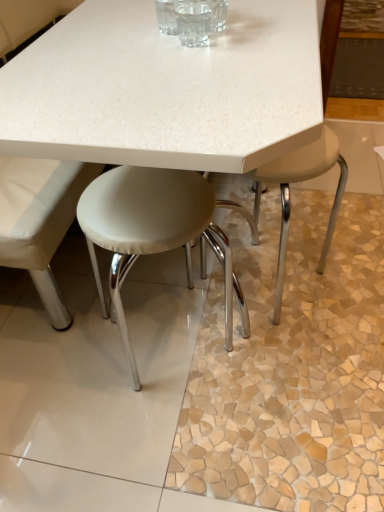
Find the location of a particular element. The image size is (384, 512). vacant space in front of transparent glass at center is located at coordinates (204, 75).